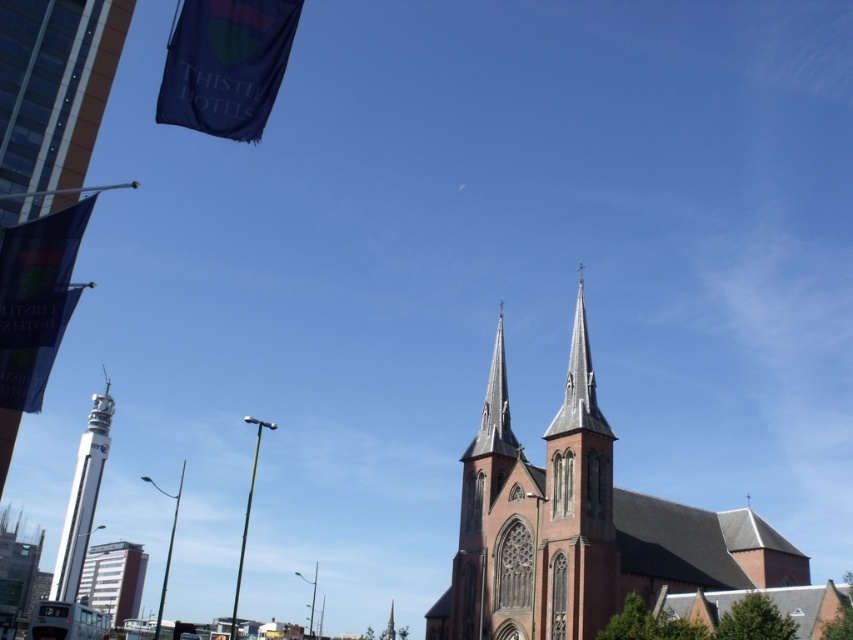
Question: Does red brick church steeple at center lie behind red brick tower at lower left?

Choices:
 (A) no
 (B) yes

Answer: (A)

Question: Considering the real-world distances, which object is farthest from the red brick tower at lower left?

Choices:
 (A) metallic silver bus at lower left
 (B) red brick church at center

Answer: (B)

Question: Which object appears farthest from the camera in this image?

Choices:
 (A) white glossy tower at left
 (B) red brick church at center
 (C) red brick tower at lower left

Answer: (C)

Question: Observing the image, what is the correct spatial positioning of red brick church at center in reference to white glossy tower at left?

Choices:
 (A) left
 (B) right

Answer: (B)

Question: Does red brick church at center have a larger size compared to red brick tower at lower left?

Choices:
 (A) no
 (B) yes

Answer: (B)

Question: Which object is closer to the camera taking this photo?

Choices:
 (A) red brick tower at lower left
 (B) white glossy tower at left

Answer: (B)